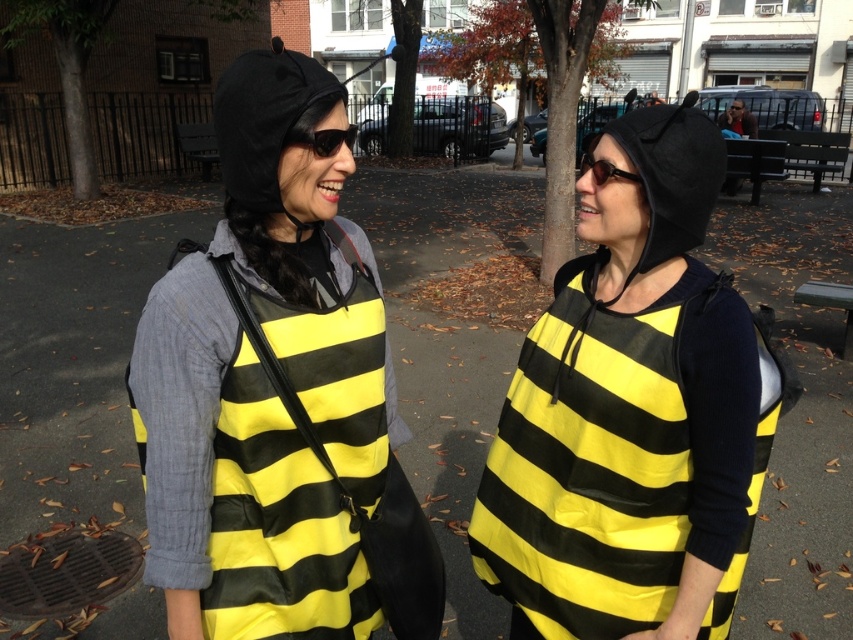
Who is positioned more to the right, yellow matte fabric bee costume at center or matte black hoodie at center?

matte black hoodie at center

Is yellow matte fabric bee costume at center positioned behind matte black hoodie at center?

No, yellow matte fabric bee costume at center is in front of matte black hoodie at center.

Find the location of a particular element. The height and width of the screenshot is (640, 853). yellow matte fabric bee costume at center is located at coordinates (265, 381).

Can you confirm if yellow fabric bee costume at center is smaller than yellow matte fabric bee costume at center?

Incorrect, yellow fabric bee costume at center is not smaller in size than yellow matte fabric bee costume at center.

Is yellow fabric bee costume at center thinner than yellow matte fabric bee costume at center?

No.

Does point (668, 384) lie in front of point (343, 429)?

Yes, point (668, 384) is in front of point (343, 429).

Find the location of a particular element. This screenshot has width=853, height=640. yellow fabric bee costume at center is located at coordinates (267, 384).

Between yellow matte fabric bee costume at center and black plastic sunglasses at center, which one appears on the right side from the viewer's perspective?

From the viewer's perspective, black plastic sunglasses at center appears more on the right side.

Can you confirm if yellow matte fabric bee costume at center is positioned to the right of black plastic sunglasses at center?

No, yellow matte fabric bee costume at center is not to the right of black plastic sunglasses at center.

What do you see at coordinates (265, 381) in the screenshot? This screenshot has width=853, height=640. I see `yellow matte fabric bee costume at center` at bounding box center [265, 381].

Locate an element on the screen. yellow matte fabric bee costume at center is located at coordinates (265, 381).